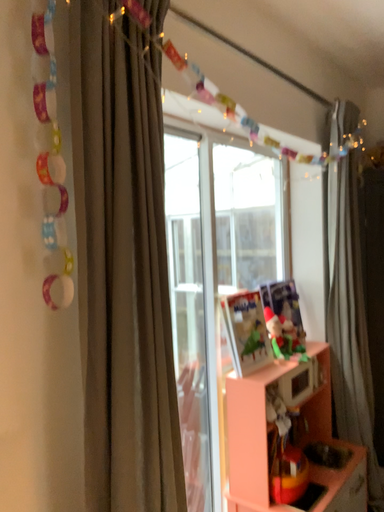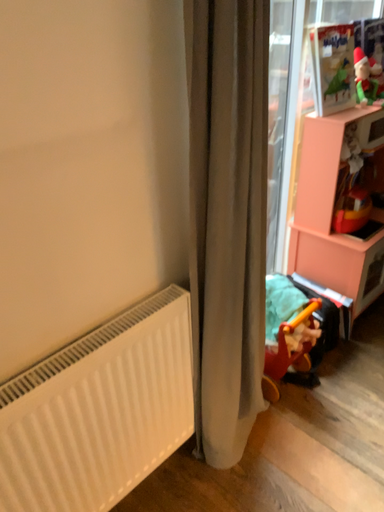
Question: How did the camera likely rotate when shooting the video?

Choices:
 (A) rotated downward
 (B) rotated upward

Answer: (A)